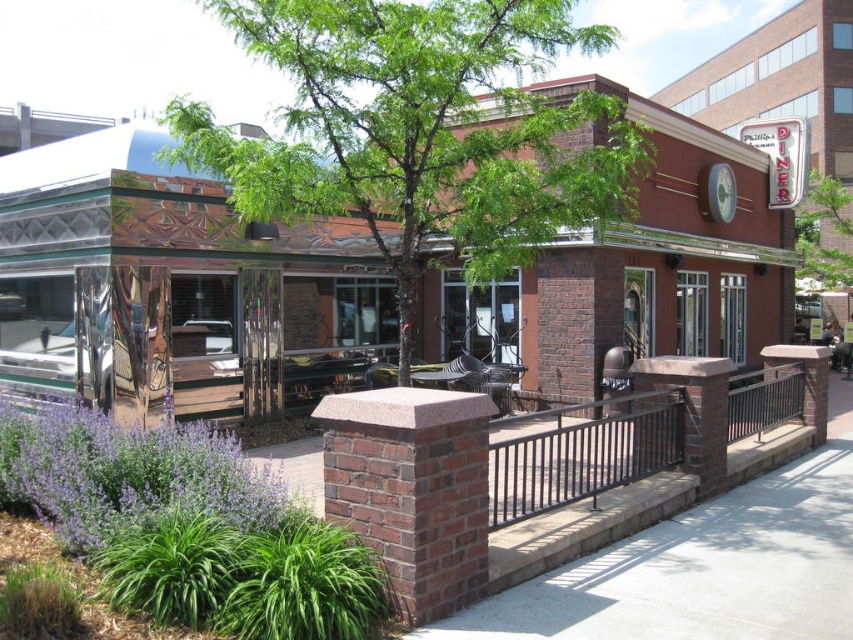
Who is shorter, green leafy tree at center or smooth concrete pavement at center?

With less height is smooth concrete pavement at center.

Looking at this image, is green leafy tree at center behind smooth concrete pavement at center?

No, green leafy tree at center is closer to the viewer.

Is point (546, 12) positioned after point (759, 636)?

That is True.

Find the location of a particular element. Image resolution: width=853 pixels, height=640 pixels. green leafy tree at center is located at coordinates (421, 131).

Does brick diner at center appear on the left side of metallic silver table at center?

Incorrect, brick diner at center is not on the left side of metallic silver table at center.

Can you confirm if brick diner at center is wider than metallic silver table at center?

Indeed, brick diner at center has a greater width compared to metallic silver table at center.

Who is more distant from viewer, (128, 176) or (415, 376)?

The point (415, 376) is behind.

The image size is (853, 640). I want to click on brick diner at center, so click(x=189, y=289).

Is green leafy tree at center below black metal railing at lower right?

No, green leafy tree at center is not below black metal railing at lower right.

Is green leafy tree at center above black metal railing at lower right?

Correct, green leafy tree at center is located above black metal railing at lower right.

I want to click on green leafy tree at center, so click(421, 131).